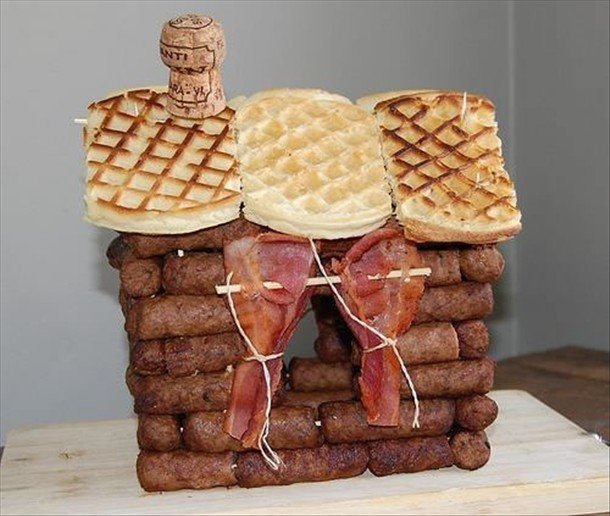
Image resolution: width=610 pixels, height=516 pixels. I want to click on wooden table under tray, so click(x=575, y=407).